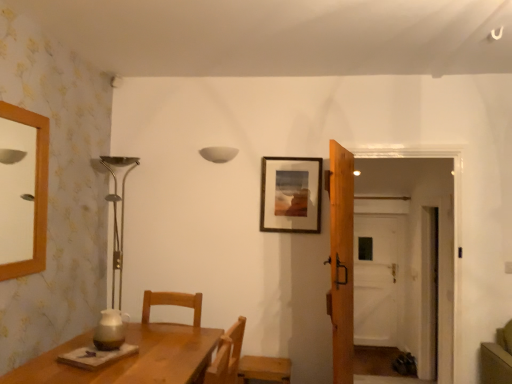
Question: Considering the relative sizes of wooden chair at lower right and wooden door at center in the image provided, is wooden chair at lower right taller than wooden door at center?

Choices:
 (A) yes
 (B) no

Answer: (B)

Question: From the image's perspective, is wooden chair at lower right located beneath wooden door at center?

Choices:
 (A) yes
 (B) no

Answer: (A)

Question: From the image's perspective, is wooden chair at lower right on wooden door at center?

Choices:
 (A) yes
 (B) no

Answer: (B)

Question: Is wooden chair at lower right oriented towards wooden door at center?

Choices:
 (A) yes
 (B) no

Answer: (B)

Question: Can we say wooden chair at lower right lies outside wooden door at center?

Choices:
 (A) yes
 (B) no

Answer: (A)

Question: Considering the positions of wooden door at center and white matte lampshade at upper center in the image, is wooden door at center bigger or smaller than white matte lampshade at upper center?

Choices:
 (A) big
 (B) small

Answer: (A)

Question: Considering the positions of wooden door at center and white matte lampshade at upper center in the image, is wooden door at center wider or thinner than white matte lampshade at upper center?

Choices:
 (A) thin
 (B) wide

Answer: (B)

Question: From a real-world perspective, relative to white matte lampshade at upper center, is wooden door at center vertically above or below?

Choices:
 (A) below
 (B) above

Answer: (A)

Question: In the image, is wooden door at center on the left side or the right side of white matte lampshade at upper center?

Choices:
 (A) left
 (B) right

Answer: (B)

Question: Is transparent glass door at center to the left or to the right of wooden door at center in the image?

Choices:
 (A) right
 (B) left

Answer: (A)

Question: Considering the positions of point (387, 342) and point (327, 309), is point (387, 342) closer or farther from the camera than point (327, 309)?

Choices:
 (A) closer
 (B) farther

Answer: (B)

Question: Is transparent glass door at center spatially inside wooden door at center, or outside of it?

Choices:
 (A) outside
 (B) inside

Answer: (A)

Question: Considering the positions of transparent glass door at center and wooden door at center in the image, is transparent glass door at center wider or thinner than wooden door at center?

Choices:
 (A) thin
 (B) wide

Answer: (A)

Question: Is transparent glass door at center inside or outside of wooden chair at lower right?

Choices:
 (A) inside
 (B) outside

Answer: (B)

Question: From a real-world perspective, is transparent glass door at center above or below wooden chair at lower right?

Choices:
 (A) below
 (B) above

Answer: (B)